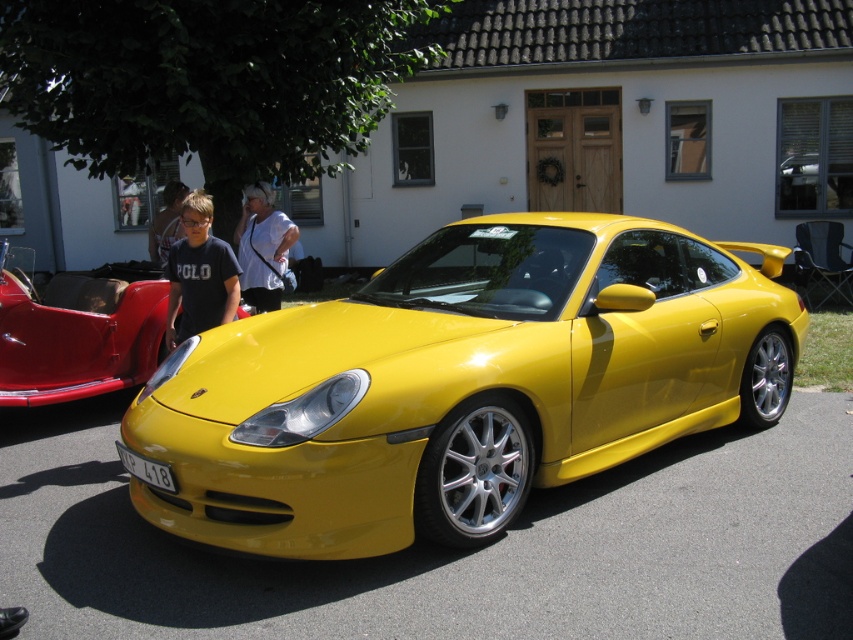
Question: From the image, what is the correct spatial relationship of matte black shirt at left in relation to light brown hair at center?

Choices:
 (A) left
 (B) right

Answer: (B)

Question: Is matte black shirt at left below white fabric shirt at center?

Choices:
 (A) yes
 (B) no

Answer: (A)

Question: Based on their relative distances, which object is nearer to the white fabric shirt at center?

Choices:
 (A) white plastic license plate at lower center
 (B) light brown hair at center
 (C) matte black shirt at left
 (D) shiny yellow sports car at center

Answer: (D)

Question: Does shiny yellow sports car at center lie in front of white fabric shirt at center?

Choices:
 (A) yes
 (B) no

Answer: (A)

Question: Which point is farther from the camera taking this photo?

Choices:
 (A) (33, 392)
 (B) (252, 272)
 (C) (170, 349)
 (D) (126, 448)

Answer: (B)

Question: Estimate the real-world distances between objects in this image. Which object is closer to the glossy yellow car at center?

Choices:
 (A) white plastic license plate at lower center
 (B) matte black shirt at left
 (C) white fabric shirt at center
 (D) shiny yellow sports car at center

Answer: (B)